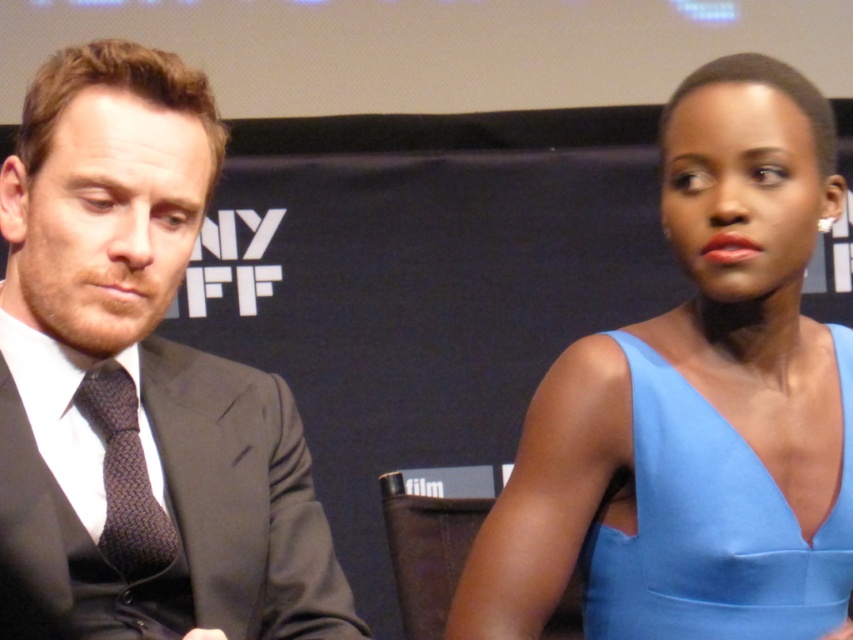
Is matte black suit at left to the left of dark brown textured tie at left from the viewer's perspective?

No, matte black suit at left is not to the left of dark brown textured tie at left.

The width and height of the screenshot is (853, 640). Identify the location of matte black suit at left. (138, 385).

Who is more forward, (103,460) or (502,529)?

Point (103,460) is more forward.

Can you confirm if matte black suit at left is wider than blue satin dress at right?

In fact, matte black suit at left might be narrower than blue satin dress at right.

Measure the distance between matte black suit at left and camera.

Answer: matte black suit at left and camera are 35.52 inches apart.

You are a GUI agent. You are given a task and a screenshot of the screen. Output one action in this format:
    pyautogui.click(x=<x>, y=<y>)
    Task: Click on the matte black suit at left
    This screenshot has height=640, width=853.
    Given the screenshot: What is the action you would take?
    pyautogui.click(x=138, y=385)

Based on the photo, between blue satin dress at right and light blue satin dress at right, which one has less height?

light blue satin dress at right is shorter.

Between point (770, 620) and point (666, 577), which one is positioned behind?

The point (666, 577) is more distant.

Measure the distance between blue satin dress at right and camera.

blue satin dress at right is 3.30 feet away from camera.

This screenshot has width=853, height=640. I want to click on blue satin dress at right, so click(x=683, y=369).